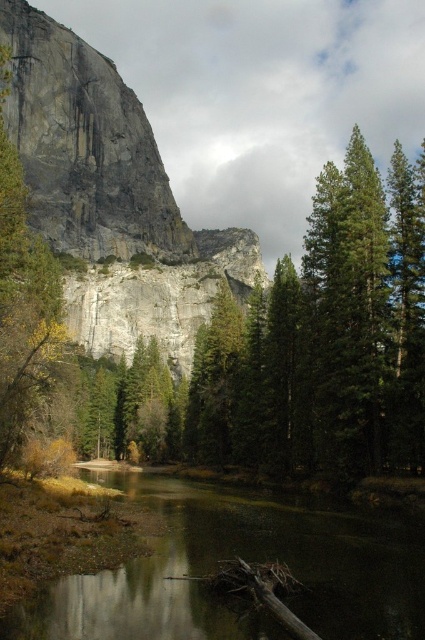
You are standing at the edge of the scene and want to reach the green matte tree at left. Which direction should you move to get closer to it without crossing the green smooth water at center?

You should move to the left side because the green smooth water at center is closer to you than the green matte tree at left, so moving left would avoid crossing the water and get closer to the tree.

You are standing at the base of the cliff and want to reach a hidden treasure located at point (8,388). There is an obstacle at point (251,525) blocking your path. Can you walk around it by moving to the right side of the obstacle?

The point (251,525) is in front of point (8,388), so the obstacle is directly in your path. You cannot walk around it by moving to the right side because the obstacle is blocking the way forward.

You are standing at the edge of the green smooth water at center and want to take a photo of the gray rock cliff at upper center. In which direction should you point your camera to capture the cliff in the frame?

You should point your camera to the left to capture the gray rock cliff at upper center since it is located to the left of the green smooth water at center.